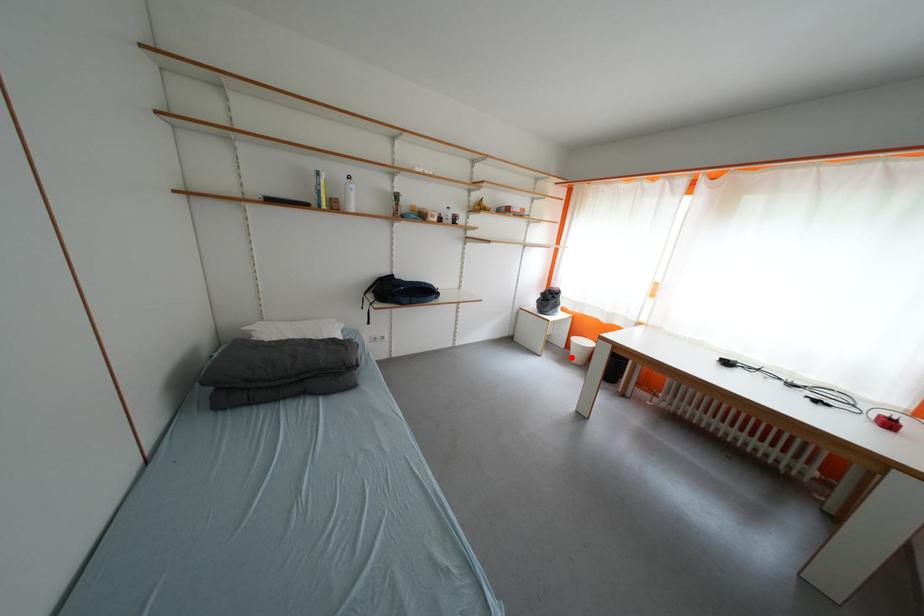
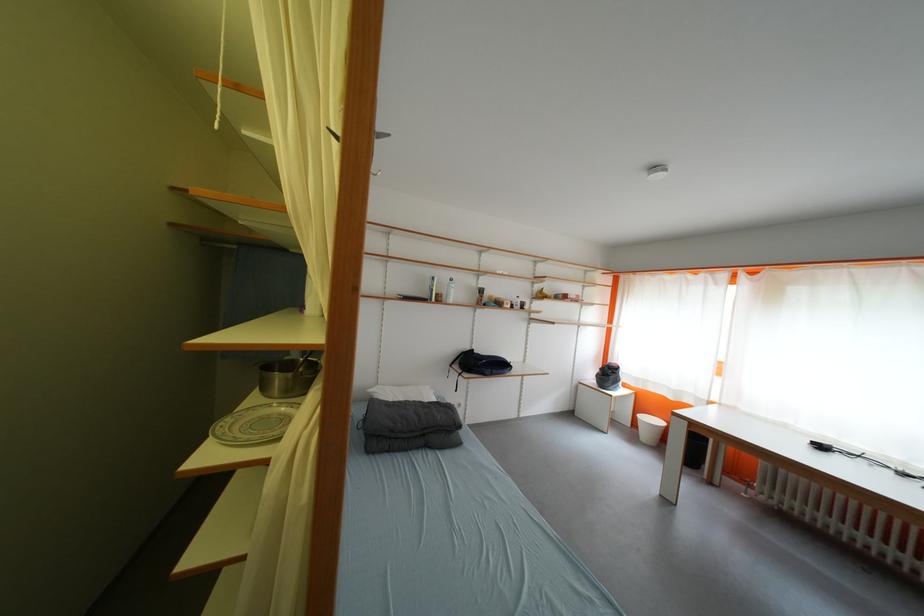
Question: I am providing you with two images of the same scene from different viewpoints. Given a red point in image1, look at the same physical point in image2. Is it:

Choices:
 (A) Closer to the viewpoint
 (B) Farther from the viewpoint

Answer: (B)